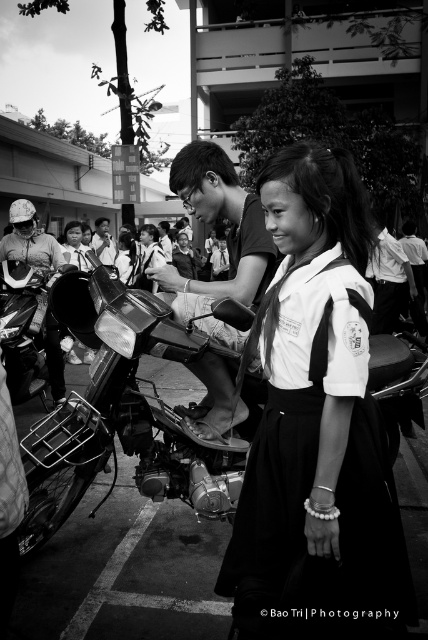
Does white uniform at center have a lesser height compared to metallic chrome motorcycle at center?

No.

Does point (309, 572) lie behind point (115, 276)?

No, it is in front of (115, 276).

The height and width of the screenshot is (640, 428). I want to click on white uniform at center, so click(x=317, y=428).